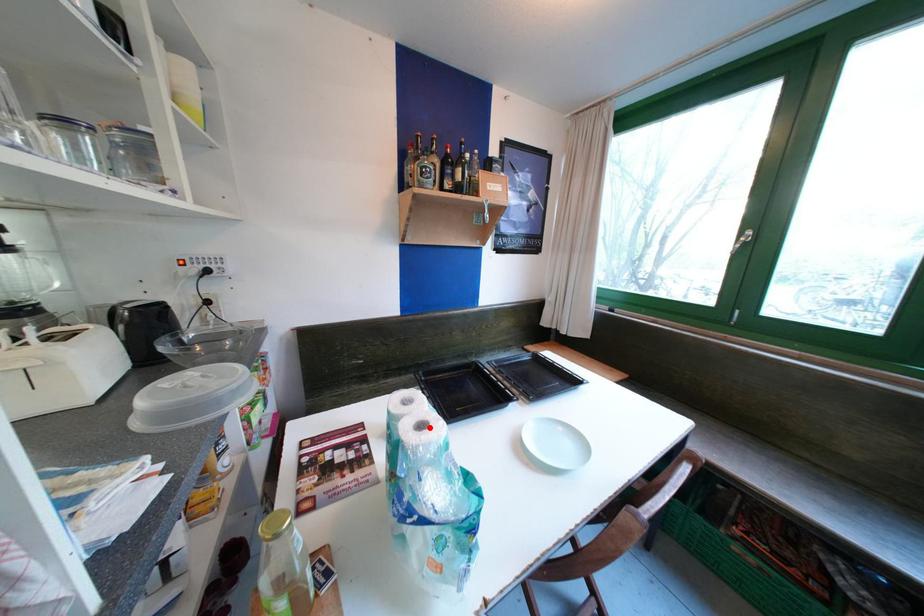
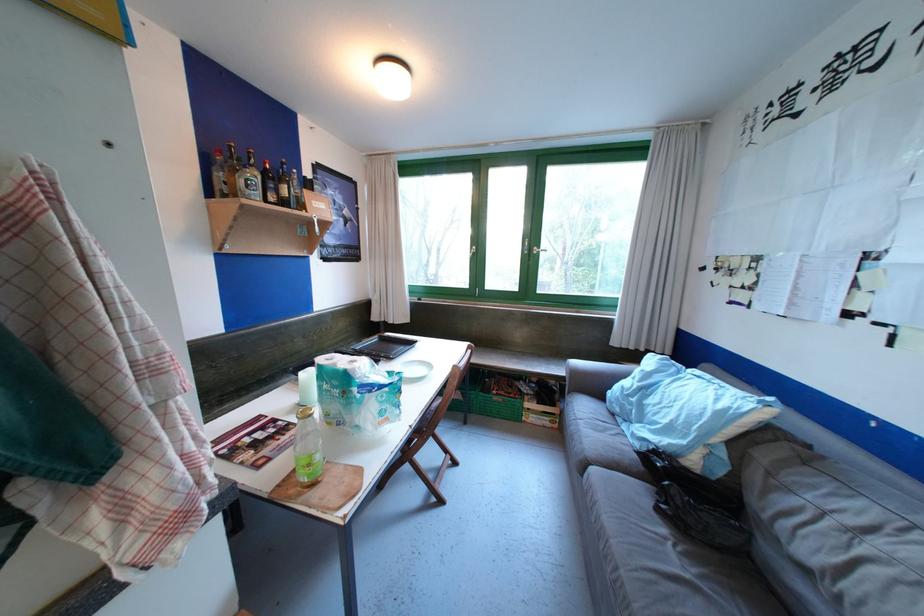
Question: I am providing you with two images of the same scene from different viewpoints. A red point is shown in image1. For the corresponding object point in image2, is it positioned nearer or farther from the camera?

Choices:
 (A) Nearer
 (B) Farther

Answer: (A)